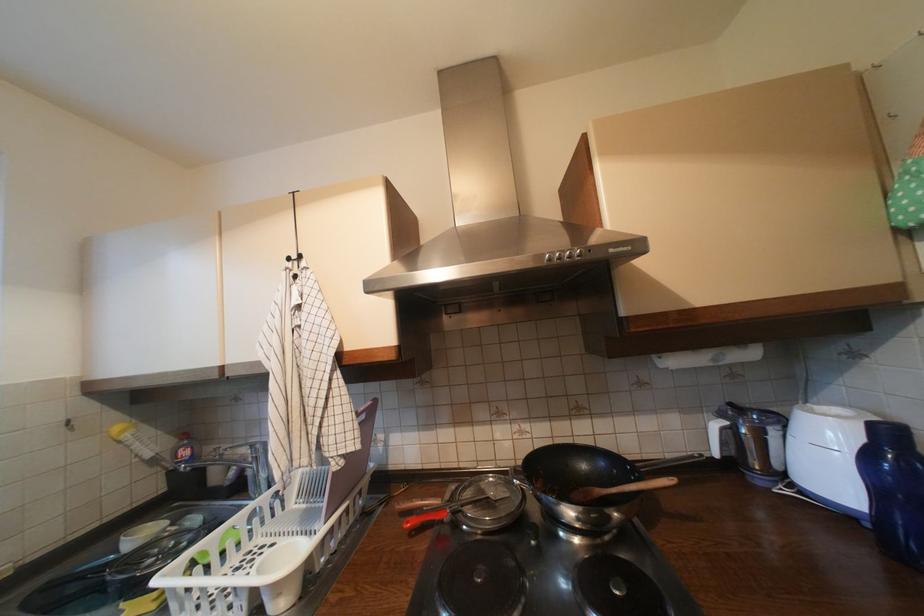
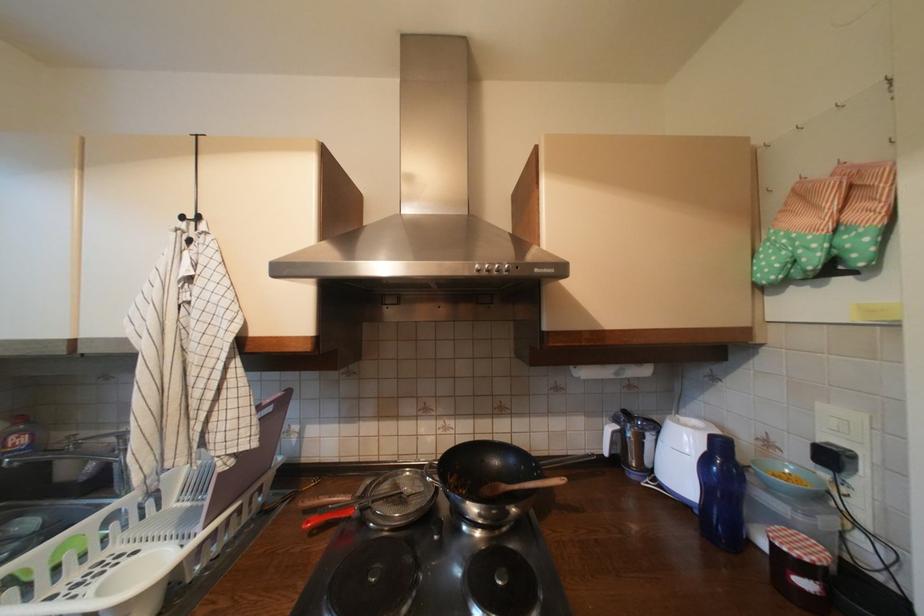
In the second image, find the point that corresponds to (296,270) in the first image.

(187, 230)